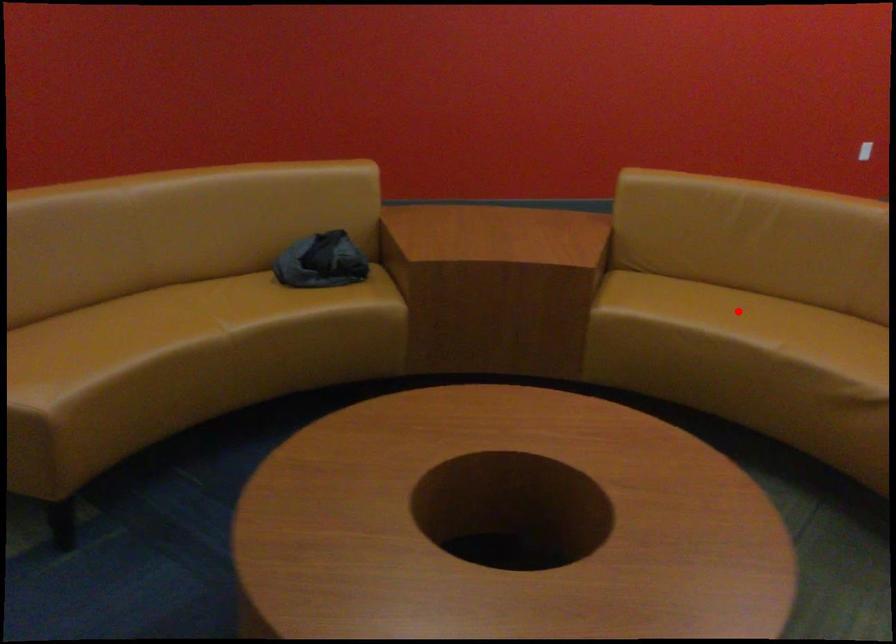
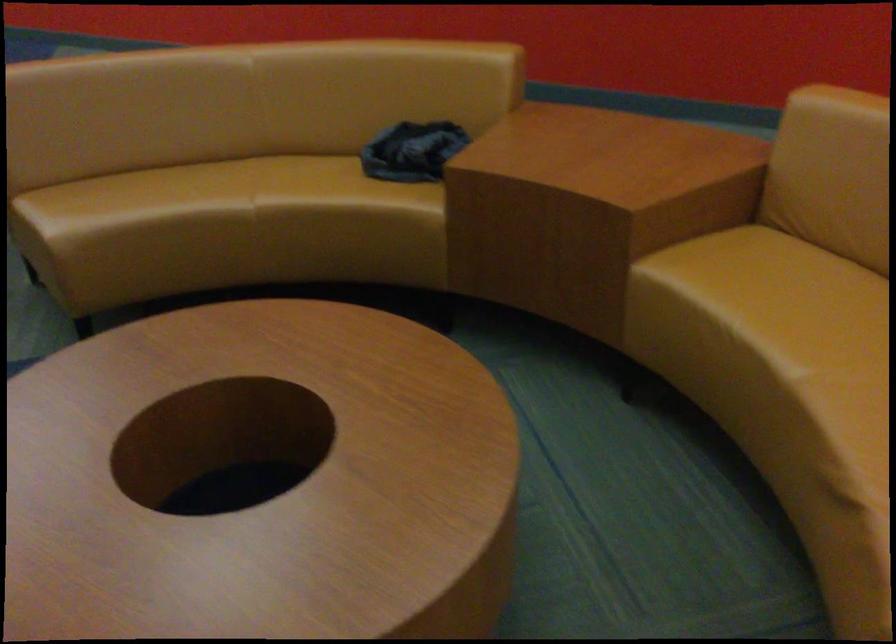
Question: I am providing you with two images of the same scene from different viewpoints. Given a red point in image1, look at the same physical point in image2. Is it:

Choices:
 (A) Closer to the viewpoint
 (B) Farther from the viewpoint

Answer: (A)